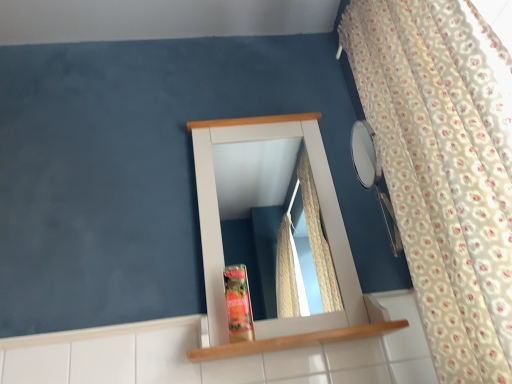
Question: Does matte plastic toiletry at center come in front of wooden shelf at center?

Choices:
 (A) yes
 (B) no

Answer: (B)

Question: Is matte plastic toiletry at center oriented towards wooden shelf at center?

Choices:
 (A) yes
 (B) no

Answer: (B)

Question: Is matte plastic toiletry at center oriented away from wooden shelf at center?

Choices:
 (A) yes
 (B) no

Answer: (B)

Question: Is matte plastic toiletry at center positioned far away from wooden shelf at center?

Choices:
 (A) yes
 (B) no

Answer: (B)

Question: Is matte plastic toiletry at center outside of wooden shelf at center?

Choices:
 (A) yes
 (B) no

Answer: (A)

Question: Is matte plastic toiletry at center behind wooden shelf at center?

Choices:
 (A) no
 (B) yes

Answer: (B)

Question: Is white wood medicine cabinet at center looking in the opposite direction of white floral fabric curtain at right?

Choices:
 (A) no
 (B) yes

Answer: (A)

Question: Is white wood medicine cabinet at center facing towards white floral fabric curtain at right?

Choices:
 (A) yes
 (B) no

Answer: (A)

Question: Considering the relative sizes of white wood medicine cabinet at center and white floral fabric curtain at right in the image provided, is white wood medicine cabinet at center thinner than white floral fabric curtain at right?

Choices:
 (A) yes
 (B) no

Answer: (A)

Question: Does white wood medicine cabinet at center lie in front of white floral fabric curtain at right?

Choices:
 (A) no
 (B) yes

Answer: (A)

Question: From the image's perspective, does white wood medicine cabinet at center appear higher than white floral fabric curtain at right?

Choices:
 (A) no
 (B) yes

Answer: (A)

Question: Can you confirm if white wood medicine cabinet at center is wider than white floral fabric curtain at right?

Choices:
 (A) yes
 (B) no

Answer: (B)

Question: Does wooden shelf at center come in front of white floral fabric curtain at right?

Choices:
 (A) yes
 (B) no

Answer: (B)